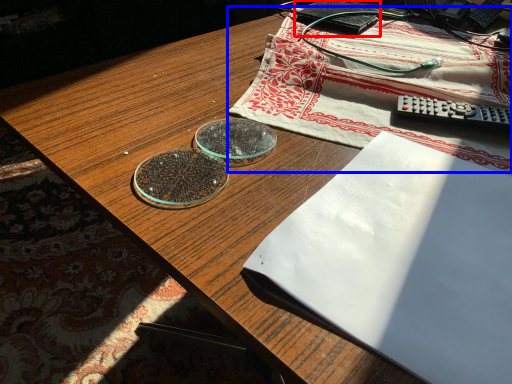
Question: Which point is further to the camera, paperback book (highlighted by a red box) or tablecloth (highlighted by a blue box)?

Choices:
 (A) paperback book
 (B) tablecloth

Answer: (A)